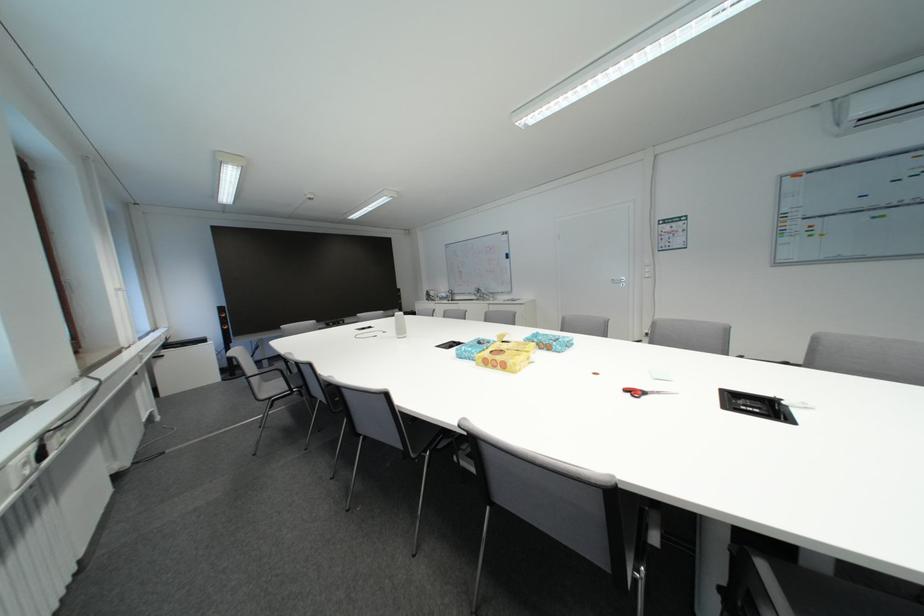
Describe the element at coordinates (283, 369) in the screenshot. Image resolution: width=924 pixels, height=616 pixels. I see `the grey chair sitting surface` at that location.